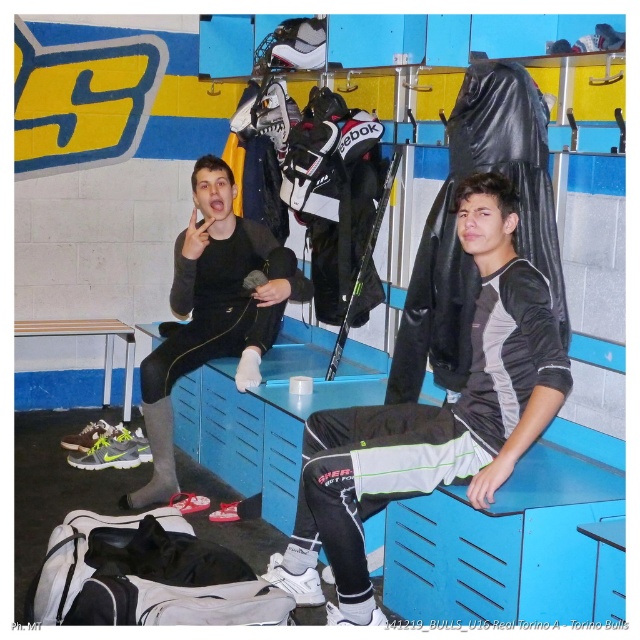
Question: Which object is farther from the camera taking this photo?

Choices:
 (A) matte black jacket at center
 (B) black matte jacket at center

Answer: (A)

Question: Where is black matte jacket at center located in relation to matte black jacket at center in the image?

Choices:
 (A) right
 (B) left

Answer: (A)

Question: Which of the following is the closest to the observer?

Choices:
 (A) black matte jacket at center
 (B) matte black jacket at center

Answer: (A)

Question: Which object appears closest to the camera in this image?

Choices:
 (A) black matte jacket at center
 (B) matte black jacket at center

Answer: (A)

Question: Where is black matte jacket at center located in relation to matte black jacket at center in the image?

Choices:
 (A) left
 (B) right

Answer: (B)

Question: Does black matte jacket at center appear under matte black jacket at center?

Choices:
 (A) yes
 (B) no

Answer: (A)